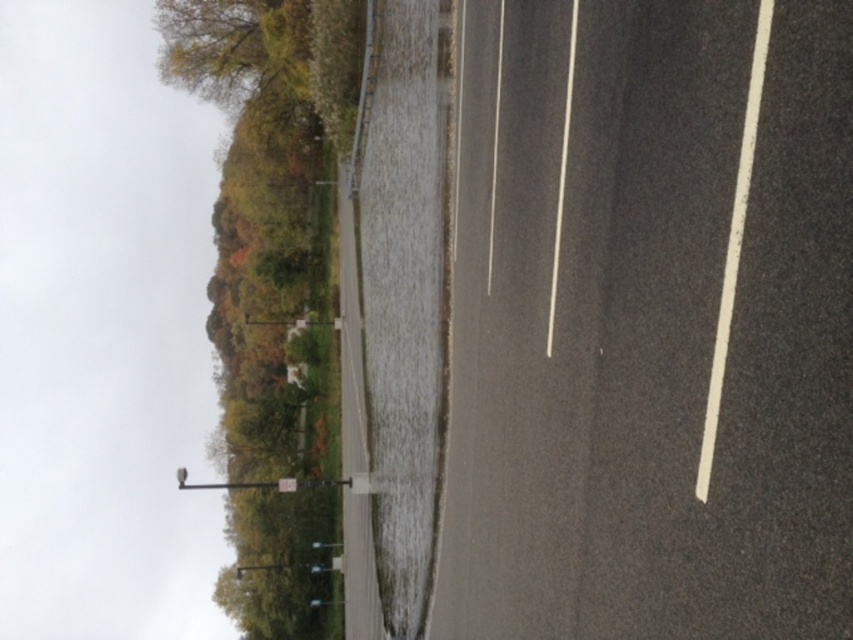
Question: From the image, what is the correct spatial relationship of black asphalt highway at center in relation to green leafy tree at upper left?

Choices:
 (A) right
 (B) left

Answer: (A)

Question: Is black asphalt highway at center below green leafy tree at upper left?

Choices:
 (A) yes
 (B) no

Answer: (B)

Question: Observing the image, what is the correct spatial positioning of black asphalt highway at center in reference to green leafy tree at upper left?

Choices:
 (A) below
 (B) above

Answer: (B)